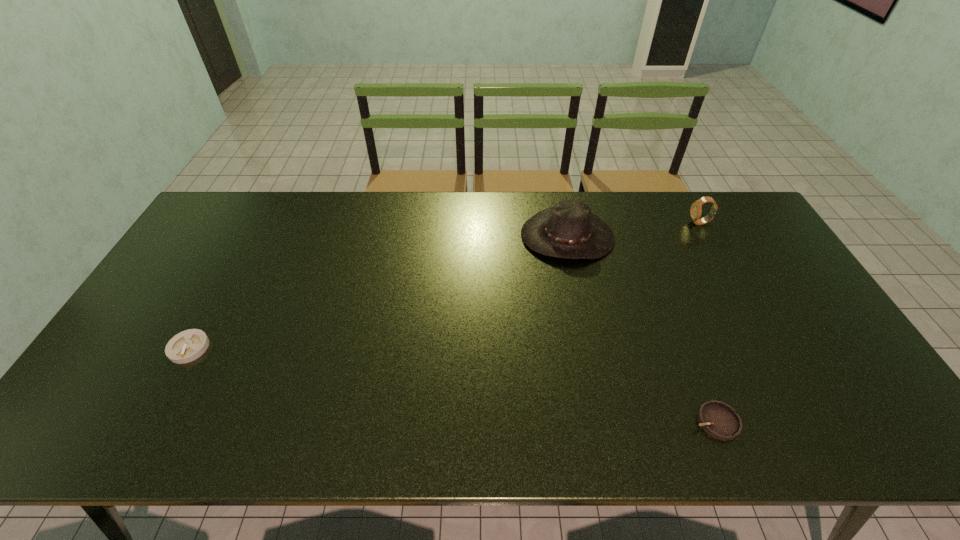
Locate an element on the screen. This screenshot has width=960, height=540. free space at the right edge of the desktop is located at coordinates (821, 365).

Locate an element on the screen. free space at the far left corner of the desktop is located at coordinates (220, 233).

You are a GUI agent. You are given a task and a screenshot of the screen. Output one action in this format:
    pyautogui.click(x=<x>, y=<y>)
    Task: Click on the vacant space at the near left corner of the desktop
    The width and height of the screenshot is (960, 540).
    Given the screenshot: What is the action you would take?
    tap(113, 426)

Where is `free space between the nearest object and the hat`? Image resolution: width=960 pixels, height=540 pixels. free space between the nearest object and the hat is located at coordinates (641, 329).

Identify the location of free space between the hat and the third object from left to right. This screenshot has height=540, width=960. (641, 329).

The height and width of the screenshot is (540, 960). I want to click on unoccupied area between the left ashtray and the watch, so click(x=444, y=285).

Image resolution: width=960 pixels, height=540 pixels. Find the location of `blank region between the left ashtray and the second object from left to right`. blank region between the left ashtray and the second object from left to right is located at coordinates (378, 292).

Image resolution: width=960 pixels, height=540 pixels. I want to click on empty location between the rightmost object and the third object from left to right, so click(708, 322).

The image size is (960, 540). Find the location of `vacant area that lies between the third farthest object and the third object from left to right`. vacant area that lies between the third farthest object and the third object from left to right is located at coordinates (452, 384).

The height and width of the screenshot is (540, 960). Identify the location of free space between the farther ashtray and the second object from left to right. (378, 292).